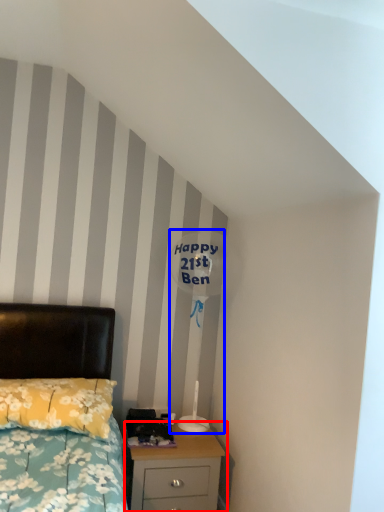
Question: Which point is closer to the camera, nightstand (highlighted by a red box) or table lamp (highlighted by a blue box)?

Choices:
 (A) nightstand
 (B) table lamp

Answer: (A)